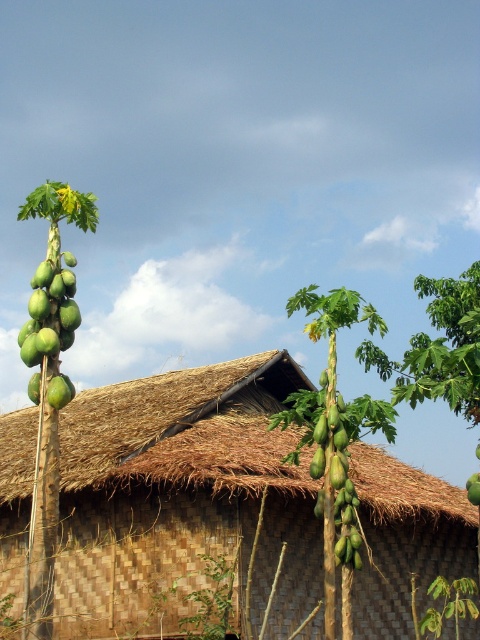
Question: Is green matte papaya at left to the left of green matte papaya at center from the viewer's perspective?

Choices:
 (A) no
 (B) yes

Answer: (B)

Question: Can you confirm if brown thatch at center is thinner than green papaya tree at left?

Choices:
 (A) no
 (B) yes

Answer: (A)

Question: Which point appears closest to the camera in this image?

Choices:
 (A) (324, 413)
 (B) (324, 508)
 (C) (187, 474)

Answer: (B)

Question: Observing the image, what is the correct spatial positioning of brown thatch at center in reference to green papaya at center?

Choices:
 (A) left
 (B) right

Answer: (A)

Question: Which is nearer to the green papaya tree at left?

Choices:
 (A) green matte papaya at left
 (B) brown thatch at center
 (C) green papaya at center

Answer: (A)

Question: Among these points, which one is farthest from the camera?

Choices:
 (A) (349, 600)
 (B) (71, 328)

Answer: (A)